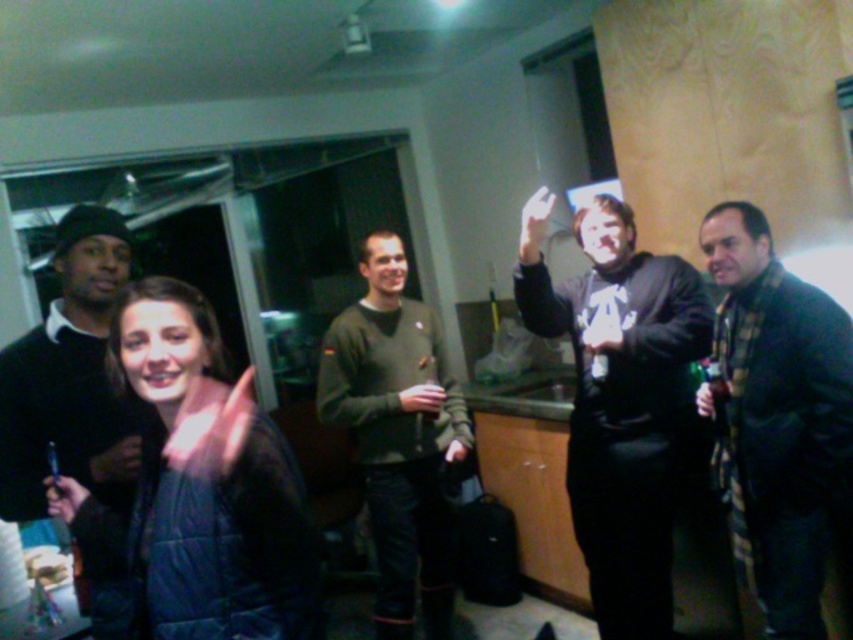
Which is in front, point (778, 436) or point (28, 336)?

Positioned in front is point (28, 336).

From the picture: Who is positioned more to the right, flannel shirt at right or matte black sweater at left?

From the viewer's perspective, flannel shirt at right appears more on the right side.

Who is more forward, (763, 500) or (111, 458)?

Point (111, 458) is more forward.

Identify the location of flannel shirt at right. (778, 417).

Between black matte hoodie at center and flannel shirt at right, which one appears on the left side from the viewer's perspective?

black matte hoodie at center

Which is more to the right, black matte hoodie at center or flannel shirt at right?

flannel shirt at right

Which is in front, point (648, 461) or point (749, 413)?

Point (749, 413) is in front.

At what (x,y) coordinates should I click in order to perform the action: click on black matte hoodie at center. Please return your answer as a coordinate pair (x, y). Looking at the image, I should click on (619, 401).

Can you confirm if dark blue puffer jacket at center is positioned to the left of flannel shirt at right?

Indeed, dark blue puffer jacket at center is positioned on the left side of flannel shirt at right.

Who is more forward, (166,387) or (764,516)?

Point (166,387)

Image resolution: width=853 pixels, height=640 pixels. Find the location of `dark blue puffer jacket at center`. dark blue puffer jacket at center is located at coordinates 199,486.

The image size is (853, 640). Identify the location of dark blue puffer jacket at center. (199, 486).